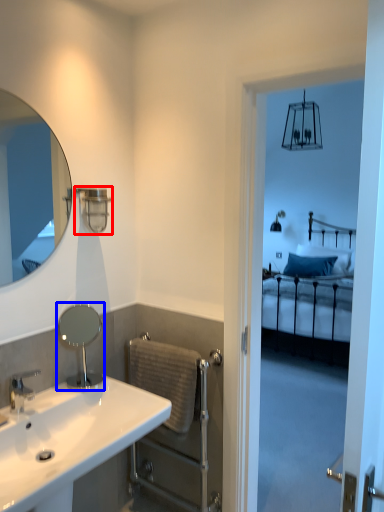
Question: Which of the following is the farthest to the observer, shower (highlighted by a red box) or mirror (highlighted by a blue box)?

Choices:
 (A) shower
 (B) mirror

Answer: (A)